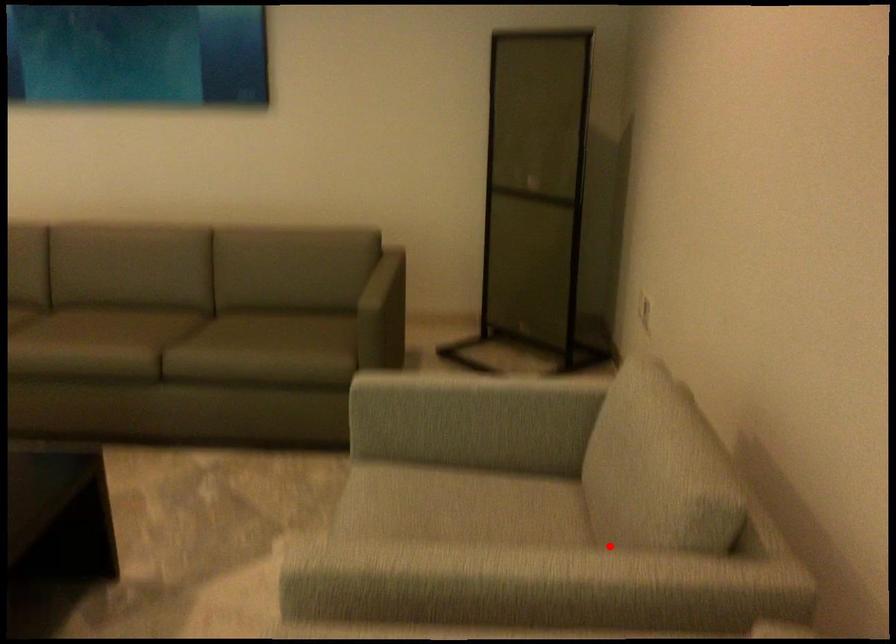
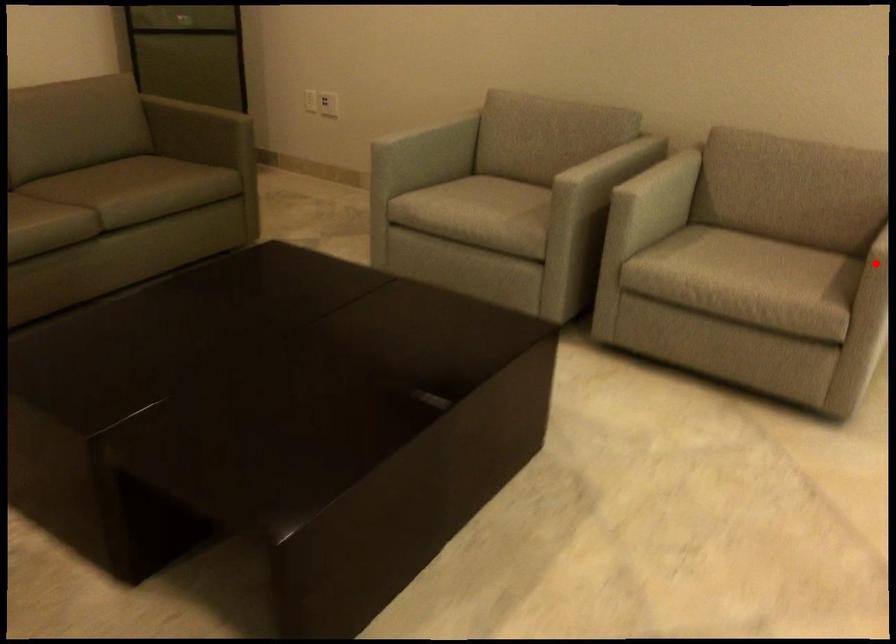
I am providing you with two images of the same scene from different viewpoints. A red point is marked on the first image and another point is marked on the second image. Are the points marked in image1 and image2 representing the same 3D position?

No